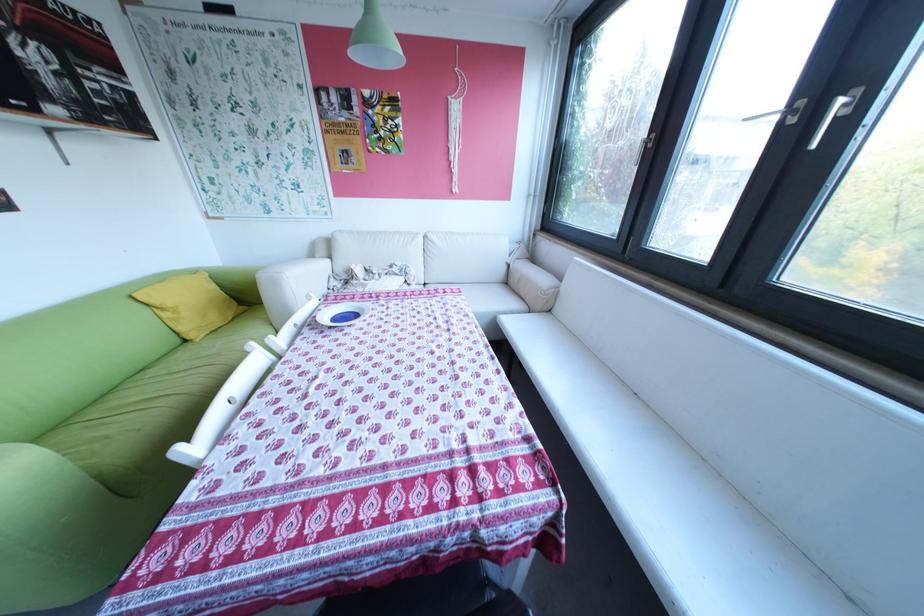
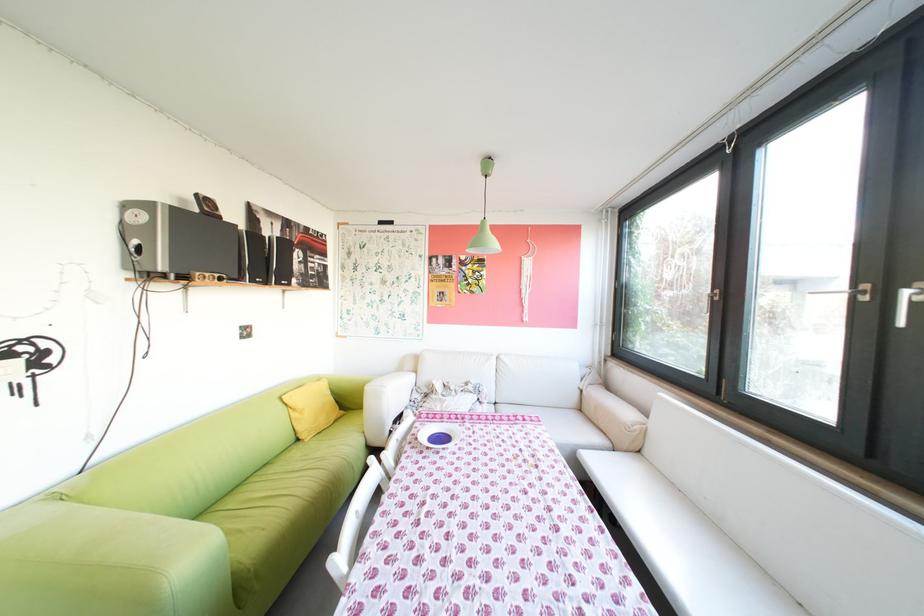
The point at (210, 339) is marked in the first image. Where is the corresponding point in the second image?

(321, 440)